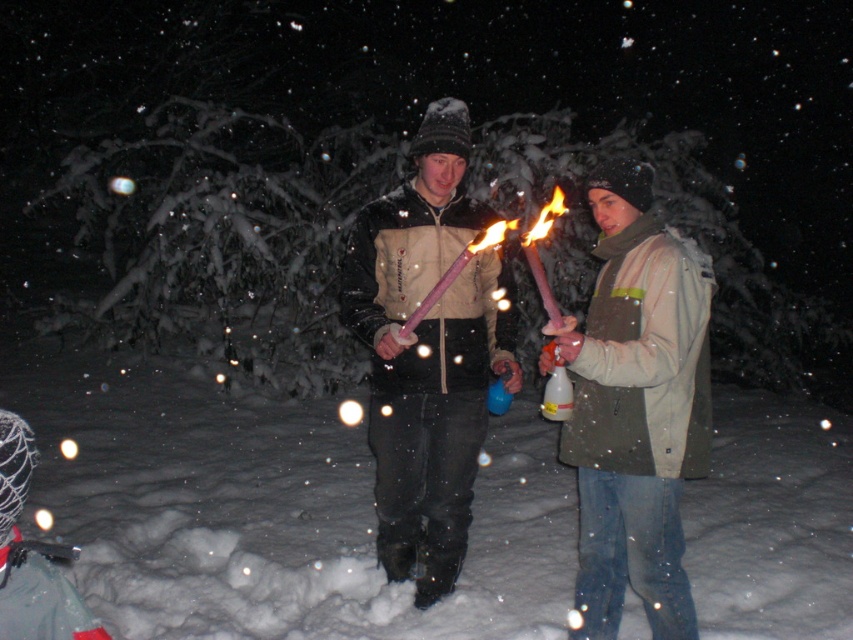
Question: Can you confirm if matte pink torch at center is bigger than matte beige vest at center?

Choices:
 (A) yes
 (B) no

Answer: (B)

Question: Among these points, which one is farthest from the camera?

Choices:
 (A) (642, 493)
 (B) (830, 477)

Answer: (B)

Question: Which of the following is the farthest from the observer?

Choices:
 (A) (589, 600)
 (B) (512, 385)

Answer: (B)

Question: Which is farther from the white fluffy snow at center?

Choices:
 (A) matte pink torch at center
 (B) khaki fabric jacket at center

Answer: (B)

Question: Does white fluffy snow at center lie behind khaki fabric jacket at center?

Choices:
 (A) no
 (B) yes

Answer: (B)

Question: Does white fluffy snow at center lie behind matte pink torch at center?

Choices:
 (A) no
 (B) yes

Answer: (B)